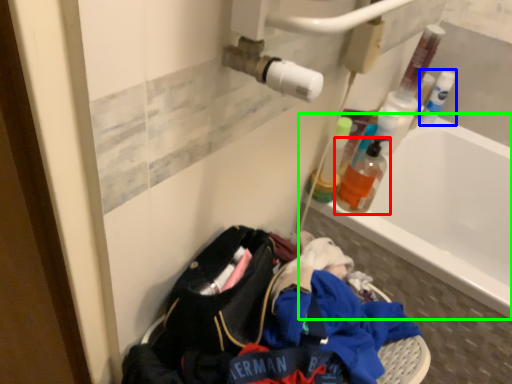
Question: Estimate the real-world distances between objects in this image. Which object is farther from bottle (highlighted by a red box), bottle (highlighted by a blue box) or bathtub (highlighted by a green box)?

Choices:
 (A) bottle
 (B) bathtub

Answer: (A)